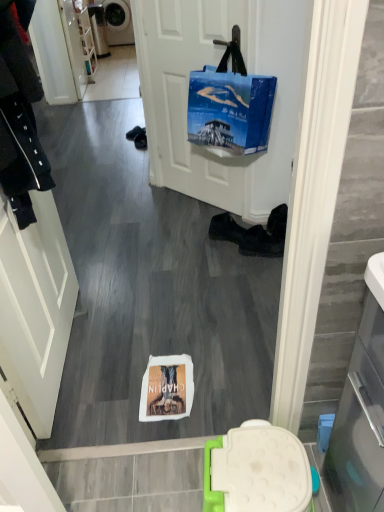
Where is `vacant area that lies between black leather boots at lower center, the second footwear positioned from the left, and white paper bag at center`? The image size is (384, 512). vacant area that lies between black leather boots at lower center, the second footwear positioned from the left, and white paper bag at center is located at coordinates (218, 305).